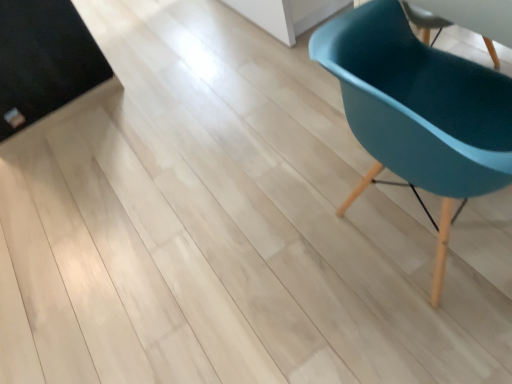
The height and width of the screenshot is (384, 512). In order to click on vacant area to the left of teal plastic chair at right in this screenshot , I will do `click(273, 274)`.